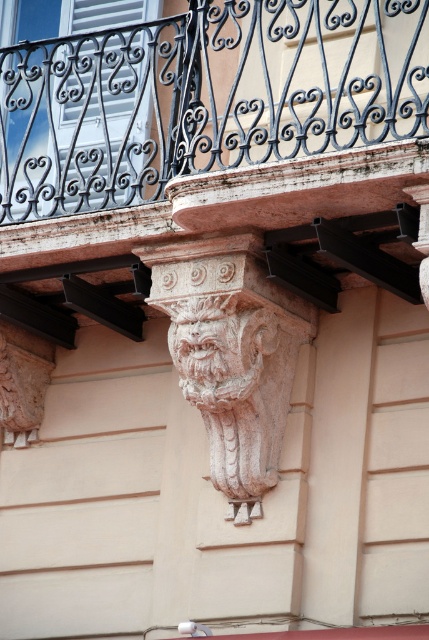
Is rustic stone balcony at center closer to camera compared to carved stone lion at center?

Yes, it is in front of carved stone lion at center.

Locate an element on the screen. This screenshot has height=640, width=429. rustic stone balcony at center is located at coordinates (202, 97).

The image size is (429, 640). I want to click on rustic stone balcony at center, so click(202, 97).

What are the coordinates of `rustic stone balcony at center` in the screenshot? It's located at (202, 97).